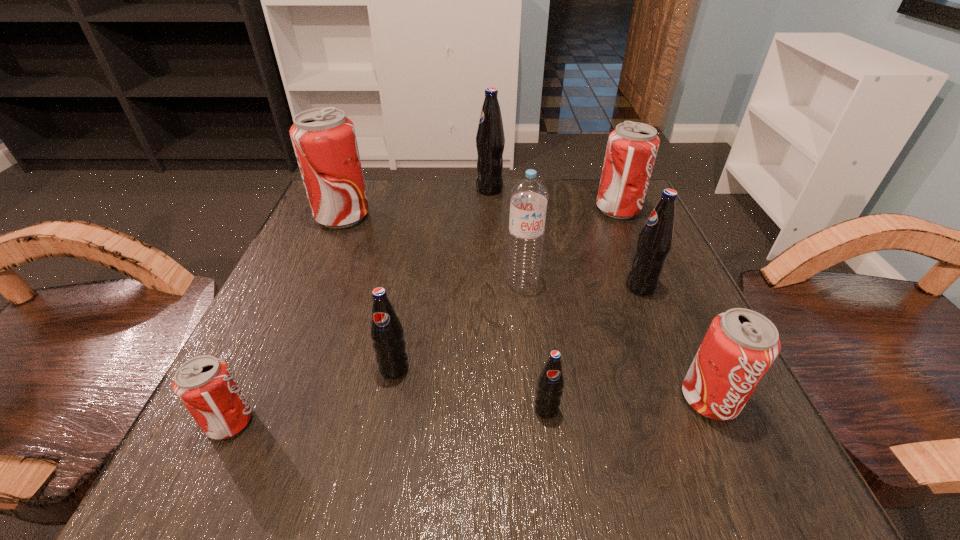
Find the location of a particular element. The image size is (960, 540). blank space at the far edge of the desktop is located at coordinates pyautogui.click(x=426, y=195).

Where is `free space at the near edge of the desktop`? The image size is (960, 540). free space at the near edge of the desktop is located at coordinates (584, 460).

You are a GUI agent. You are given a task and a screenshot of the screen. Output one action in this format:
    pyautogui.click(x=<x>, y=<y>)
    Task: Click on the vacant space at the left edge of the desktop
    The height and width of the screenshot is (540, 960).
    Given the screenshot: What is the action you would take?
    pyautogui.click(x=255, y=335)

Image resolution: width=960 pixels, height=540 pixels. In the image, there is a desktop. What are the coordinates of `free space at the right edge` in the screenshot? It's located at (582, 241).

In the image, there is a desktop. Where is `free region at the near left corner`? Image resolution: width=960 pixels, height=540 pixels. free region at the near left corner is located at coordinates (300, 472).

This screenshot has width=960, height=540. What are the coordinates of `vacant space at the near right corner of the desktop` in the screenshot? It's located at (762, 474).

What are the coordinates of `vacant space that is in between the second farthest black pop and the second biggest pink soda can` in the screenshot? It's located at (630, 248).

You are a GUI agent. You are given a task and a screenshot of the screen. Output one action in this format:
    pyautogui.click(x=<x>, y=<y>)
    Task: Click on the free space between the smallest pink soda can and the third object from left to right
    The image size is (960, 540).
    Given the screenshot: What is the action you would take?
    pyautogui.click(x=312, y=395)

Find the location of a particular element. The height and width of the screenshot is (540, 960). unoccupied position between the smallest pink soda can and the biggest pink soda can is located at coordinates (286, 319).

Where is `free space between the smallest pink soda can and the farthest object`? The width and height of the screenshot is (960, 540). free space between the smallest pink soda can and the farthest object is located at coordinates (360, 306).